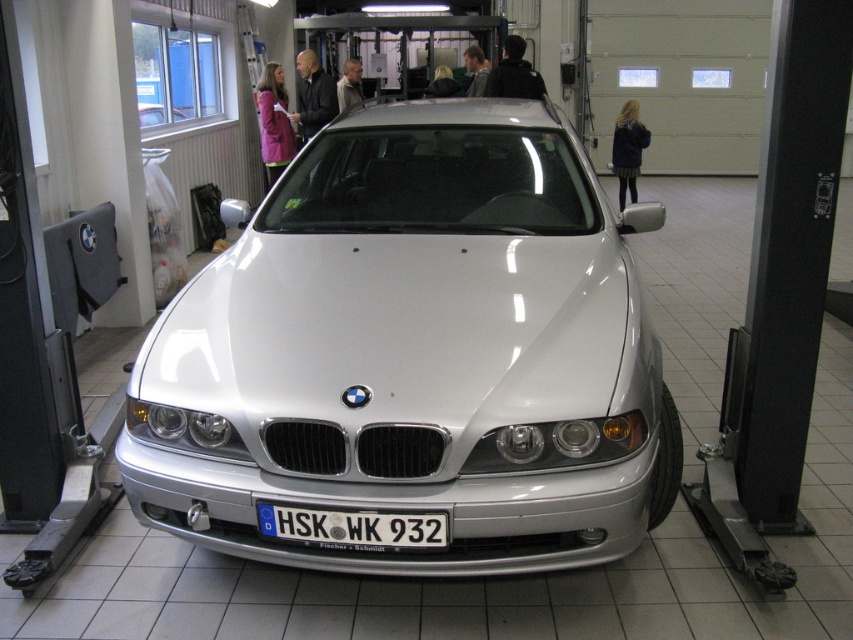
Question: Can you confirm if white metallic car at center is positioned below satin silver car at center?

Choices:
 (A) no
 (B) yes

Answer: (B)

Question: Can you confirm if white metallic car at center is wider than white plastic license plate at center?

Choices:
 (A) yes
 (B) no

Answer: (A)

Question: Among these points, which one is farthest from the camera?

Choices:
 (A) (149, 125)
 (B) (195, 369)
 (C) (392, 532)

Answer: (A)

Question: Which of the following is the closest to the observer?

Choices:
 (A) white metallic car at center
 (B) white plastic license plate at center

Answer: (B)

Question: Can you confirm if white metallic car at center is positioned below white plastic license plate at center?

Choices:
 (A) yes
 (B) no

Answer: (B)

Question: Estimate the real-world distances between objects in this image. Which object is closer to the white metallic car at center?

Choices:
 (A) white plastic license plate at center
 (B) satin silver car at center

Answer: (A)